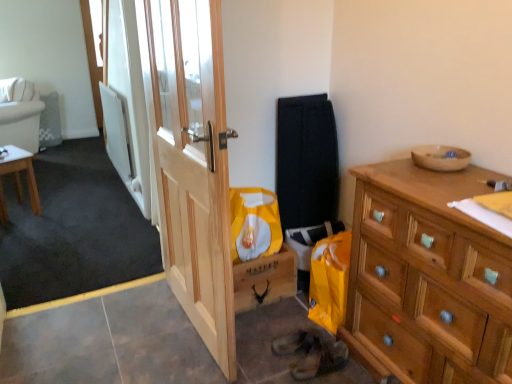
Locate an element on the screen. This screenshot has height=384, width=512. free region under leather shoe at lower center (from a real-world perspective) is located at coordinates (316, 364).